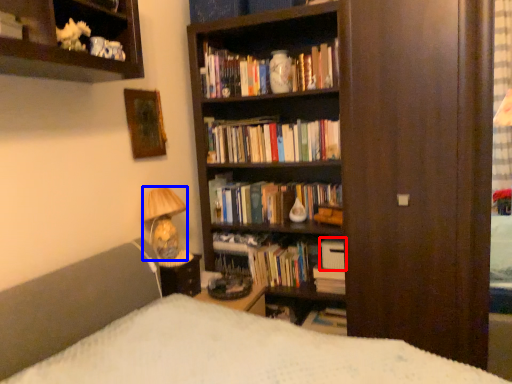
Question: Which object is further to the camera taking this photo, book (highlighted by a red box) or lamp (highlighted by a blue box)?

Choices:
 (A) book
 (B) lamp

Answer: (A)